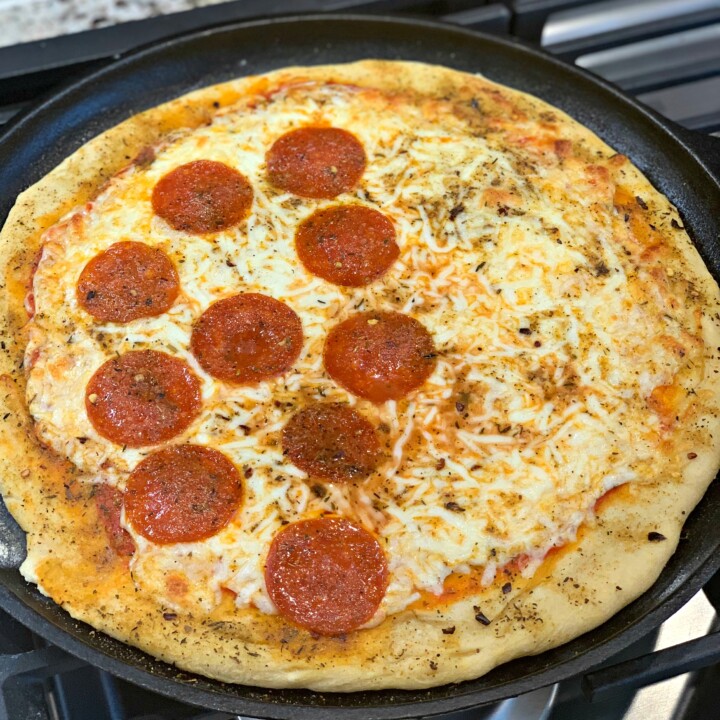
At what (x,y) coordinates should I click in order to perform the action: click on white light. Please return your answer as a coordinate pair (x, y). Looking at the image, I should click on click(677, 631).